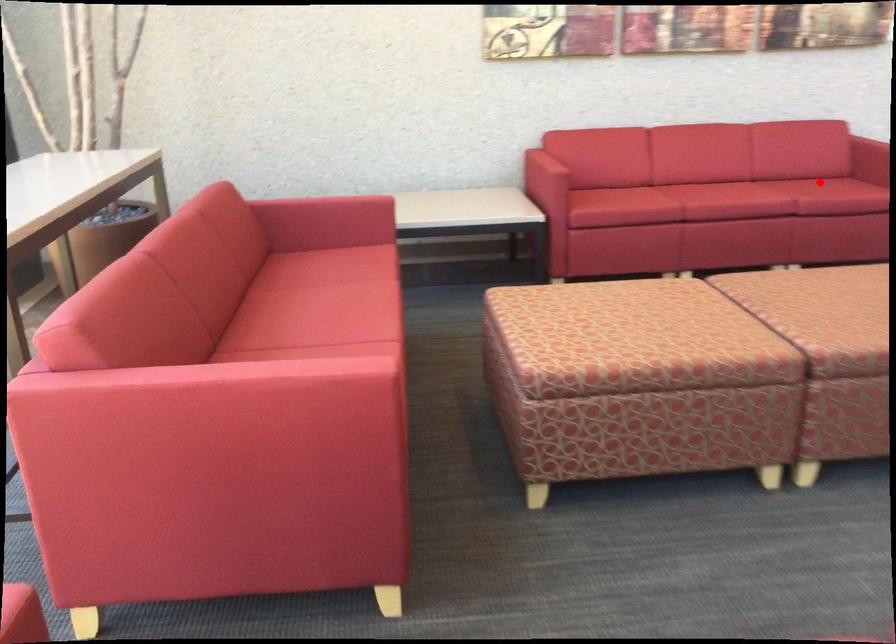
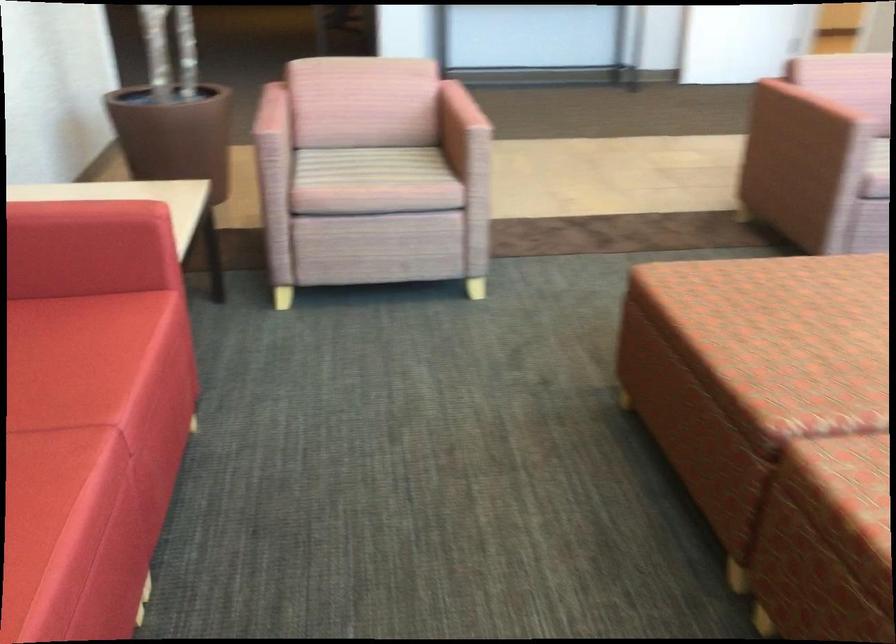
Find the pixel in the second image that matches the highlighted location in the first image.

(69, 360)